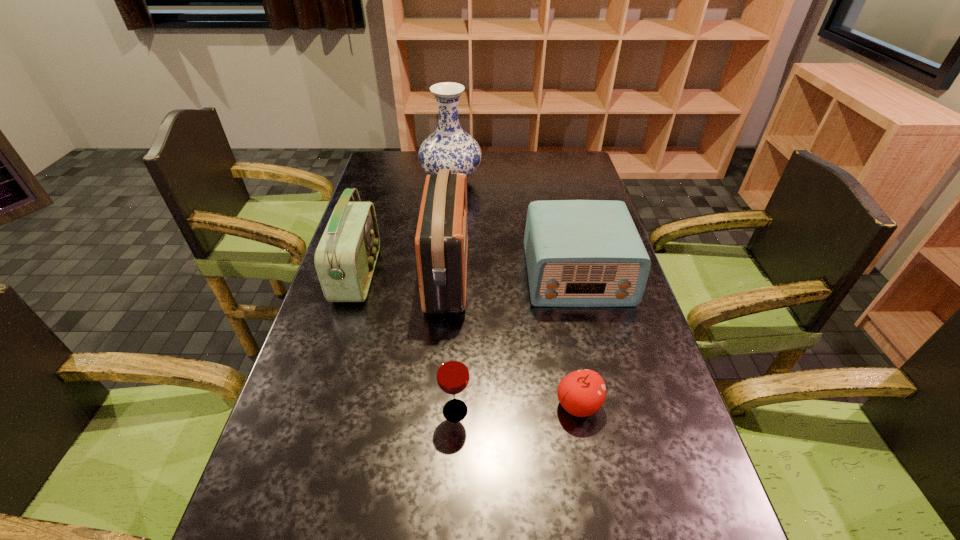
Locate an element on the screen. The height and width of the screenshot is (540, 960). object that ranks as the fourth closest to the apple is located at coordinates (345, 258).

At what (x,y) coordinates should I click in order to perform the action: click on the third closest object to the second tallest radio receiver. Please return your answer as a coordinate pair (x, y). Looking at the image, I should click on (452, 373).

Identify which radio receiver is the closest to the second shortest radio receiver. Please provide its 2D coordinates. Your answer should be formatted as a tuple, i.e. [(x, y)], where the tuple contains the x and y coordinates of a point satisfying the conditions above.

[(441, 243)]

I want to click on radio receiver that stands as the third closest to the glass, so click(345, 258).

The image size is (960, 540). In order to click on vacant region that satisfies the following two spatial constraints: 1. on the front panel of the second tallest radio receiver; 2. on the left side of the glass in this screenshot , I will do `click(316, 410)`.

This screenshot has width=960, height=540. I want to click on free space that satisfies the following two spatial constraints: 1. on the front panel of the second shortest radio receiver; 2. on the back side of the glass, so click(x=316, y=410).